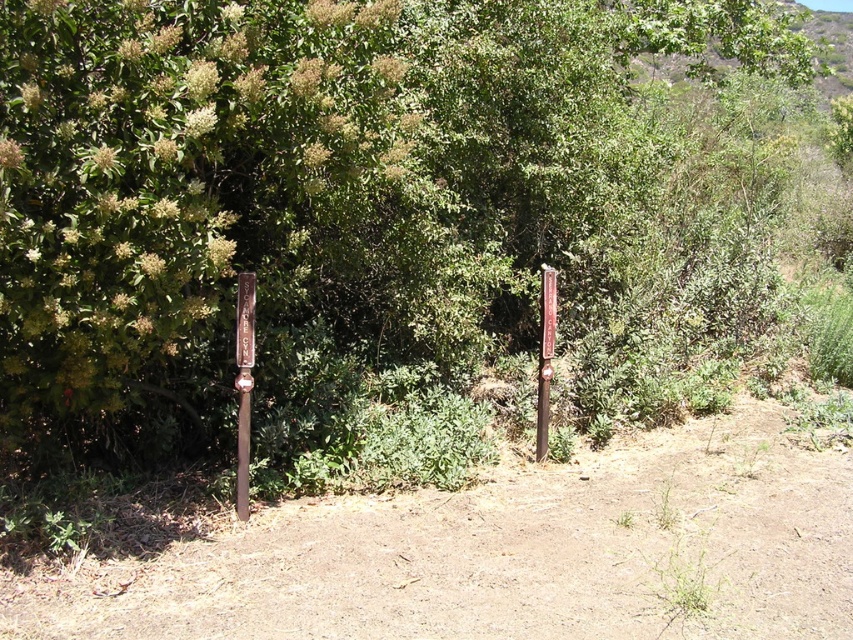
Between green matte signpost at left and brown wooden signpost at left, which one appears on the left side from the viewer's perspective?

green matte signpost at left is more to the left.

Which is in front, point (19, 61) or point (242, 445)?

Point (19, 61) is more forward.

Where is `green matte signpost at left`? The height and width of the screenshot is (640, 853). green matte signpost at left is located at coordinates (169, 172).

Which is behind, point (318, 138) or point (111, 326)?

The point (318, 138) is more distant.

From the picture: Measure the distance between green leafy tree at center and camera.

green leafy tree at center and camera are 5.25 meters apart from each other.

Who is more distant from viewer, [12,228] or [343,90]?

The point [343,90] is behind.

You are a GUI agent. You are given a task and a screenshot of the screen. Output one action in this format:
    pyautogui.click(x=<x>, y=<y>)
    Task: Click on the green leafy tree at center
    
    Given the screenshot: What is the action you would take?
    pyautogui.click(x=320, y=186)

Describe the element at coordinates (320, 186) in the screenshot. Image resolution: width=853 pixels, height=640 pixels. I see `green leafy tree at center` at that location.

Does point (247, 3) come in front of point (543, 348)?

Yes, point (247, 3) is closer to viewer.

You are a GUI agent. You are given a task and a screenshot of the screen. Output one action in this format:
    pyautogui.click(x=<x>, y=<y>)
    Task: Click on the green leafy tree at center
    
    Given the screenshot: What is the action you would take?
    pyautogui.click(x=320, y=186)